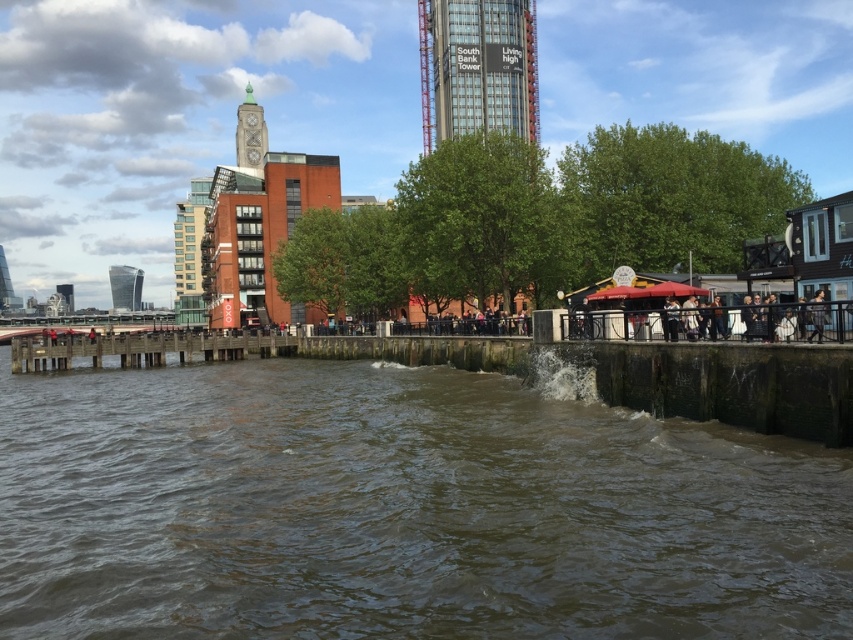
You are standing at the riverside and want to take a photo of the point at coordinates point (x=508, y=33). If your camera has a depth of field that can focus clearly up to 250 meters, will the point be in focus?

The distance of point (x=508, y=33) is 239.07 meters from the camera, which is within the 250 meters depth of field range. Therefore, the point will be in focus.

You are a tourist at the riverside and want to take a photo of both the matte gray clock tower at upper center and the silver glass tower at left. Based on their positions, which tower should you frame first in your camera viewfinder to ensure both are in the shot?

The matte gray clock tower at upper center is located above the silver glass tower at left, so you should frame the matte gray clock tower at upper center first in your camera viewfinder to ensure both are in the shot.